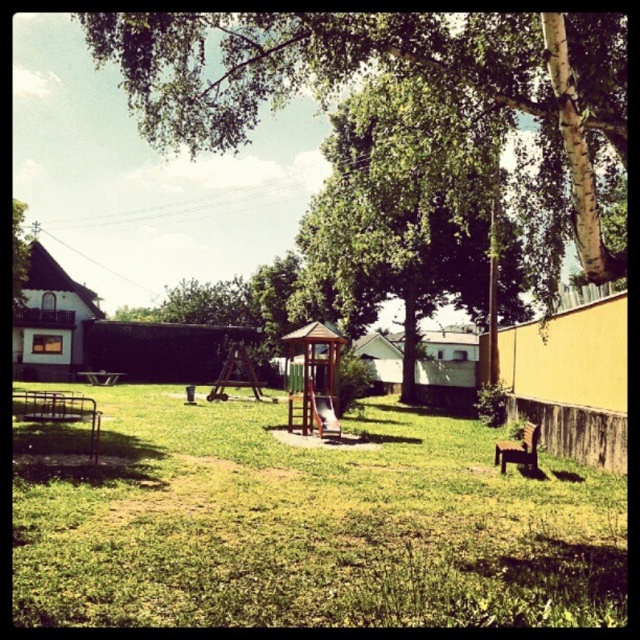
Is point (13, 282) positioned before point (92, 376)?

Yes, point (13, 282) is closer to viewer.

Describe the element at coordinates (19, 252) in the screenshot. I see `green leafy tree at upper left` at that location.

Which is in front, point (28, 252) or point (90, 376)?

Point (28, 252) is in front.

At what (x,y) coordinates should I click in order to perform the action: click on green leafy tree at upper left. Please return your answer as a coordinate pair (x, y). The height and width of the screenshot is (640, 640). Looking at the image, I should click on (19, 252).

Is point (314, 220) positioned behind point (100, 381)?

No, it is in front of (100, 381).

Measure the distance from green leafy tree at center to wooden picnic table at lower left.

They are 21.38 meters apart.

Who is more forward, [509,291] or [106,381]?

Point [509,291]

Where is `green leafy tree at center`? The width and height of the screenshot is (640, 640). green leafy tree at center is located at coordinates (397, 211).

Does green grassy at center appear on the left side of green leafy tree at center?

Correct, you'll find green grassy at center to the left of green leafy tree at center.

Can you confirm if green grassy at center is taller than green leafy tree at center?

No.

Describe the element at coordinates (310, 525) in the screenshot. I see `green grassy at center` at that location.

This screenshot has width=640, height=640. In order to click on green grassy at center in this screenshot , I will do `click(310, 525)`.